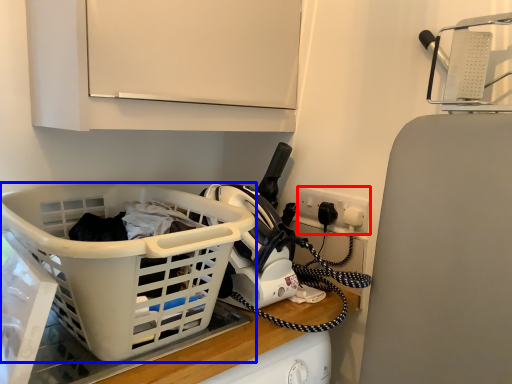
Question: Which point is closer to the camera, electric outlet (highlighted by a red box) or basket (highlighted by a blue box)?

Choices:
 (A) electric outlet
 (B) basket

Answer: (B)